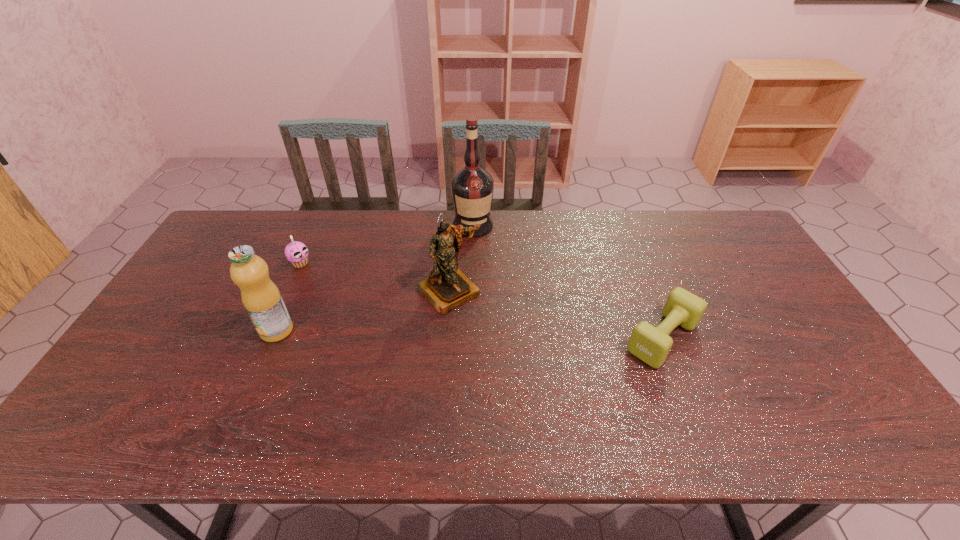
The image size is (960, 540). Find the location of `vacant area situated on the surface of the farthest object`. vacant area situated on the surface of the farthest object is located at coordinates (489, 326).

The width and height of the screenshot is (960, 540). I want to click on free space located on the surface of the farthest object, so click(x=477, y=251).

In order to click on vacant region located 0.130m on the face of the cupcake in this screenshot , I will do `click(337, 283)`.

Where is `free space located on the face of the cupcake`? Image resolution: width=960 pixels, height=540 pixels. free space located on the face of the cupcake is located at coordinates (355, 293).

Image resolution: width=960 pixels, height=540 pixels. I want to click on free space located 0.140m on the face of the cupcake, so click(x=339, y=284).

Where is `free spot located on the front-facing side of the figurine`? This screenshot has height=540, width=960. free spot located on the front-facing side of the figurine is located at coordinates (485, 330).

Where is `free point located 0.050m on the front-facing side of the figurine`? The width and height of the screenshot is (960, 540). free point located 0.050m on the front-facing side of the figurine is located at coordinates (477, 321).

The height and width of the screenshot is (540, 960). I want to click on free region located 0.110m on the front-facing side of the figurine, so click(x=490, y=335).

This screenshot has height=540, width=960. I want to click on object positioned at the far edge, so click(x=472, y=187).

Locate an element on the screen. The width and height of the screenshot is (960, 540). free space at the far edge of the desktop is located at coordinates (326, 239).